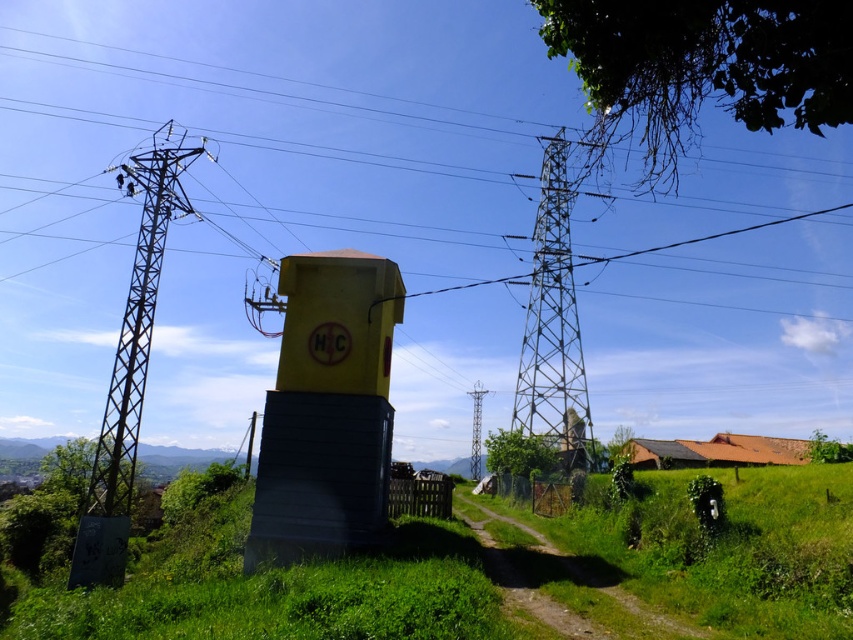
Question: Considering the relative positions of metallic gray tower at center and metallic gray tower at left in the image provided, where is metallic gray tower at center located with respect to metallic gray tower at left?

Choices:
 (A) left
 (B) right

Answer: (B)

Question: Does yellow matte water tower at center have a smaller size compared to metallic gray tower at left?

Choices:
 (A) no
 (B) yes

Answer: (B)

Question: Which object appears closest to the camera in this image?

Choices:
 (A) metallic gray tower at center
 (B) yellow matte water tower at center

Answer: (B)

Question: Can you confirm if metallic gray tower at center is positioned to the left of metallic silver tower at center?

Choices:
 (A) yes
 (B) no

Answer: (B)

Question: Which point is farther to the camera?

Choices:
 (A) (102, 460)
 (B) (555, 403)
 (C) (100, 122)

Answer: (C)

Question: Which object is farther from the camera taking this photo?

Choices:
 (A) metallic silver tower at center
 (B) metallic yellow water tower at center
 (C) metallic gray tower at center
 (D) yellow matte water tower at center

Answer: (A)